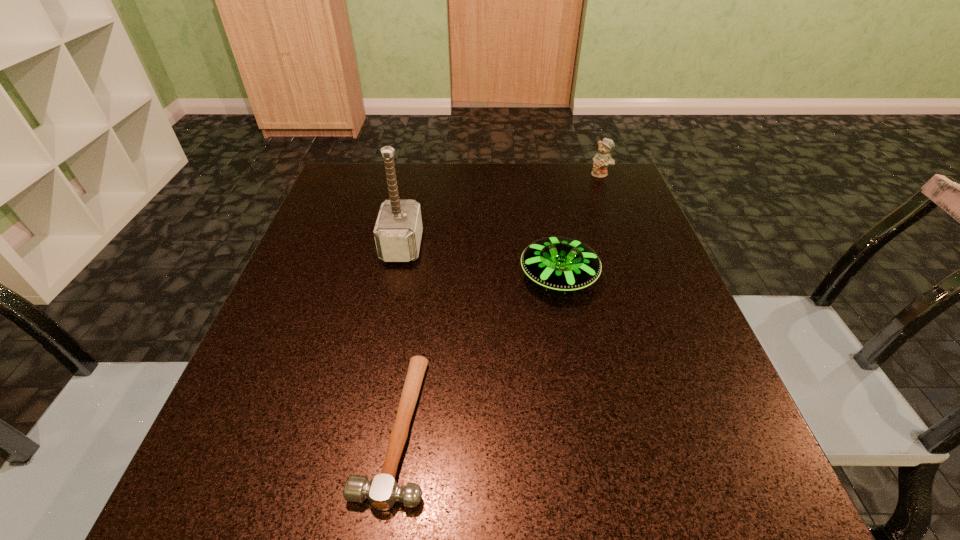
The image size is (960, 540). In order to click on free space at the right edge of the desktop in this screenshot , I will do `click(601, 242)`.

The width and height of the screenshot is (960, 540). In the image, there is a desktop. Find the location of `vacant space at the near left corner`. vacant space at the near left corner is located at coordinates (294, 486).

Locate an element on the screen. The height and width of the screenshot is (540, 960). vacant space at the far right corner of the desktop is located at coordinates (600, 188).

Where is `vacant space at the near right corner of the desktop`? vacant space at the near right corner of the desktop is located at coordinates (714, 507).

Find the location of a particular element. Image resolution: width=960 pixels, height=540 pixels. vacant area that lies between the shorter hammer and the rightmost object is located at coordinates click(498, 301).

Where is `vacant space that is in between the farther hammer and the teddy bear`? The height and width of the screenshot is (540, 960). vacant space that is in between the farther hammer and the teddy bear is located at coordinates (501, 210).

Where is `vacant area between the taller hammer and the third tallest object`? Image resolution: width=960 pixels, height=540 pixels. vacant area between the taller hammer and the third tallest object is located at coordinates (480, 262).

Identify the location of free spot between the tallest object and the nearest object. (399, 337).

Find the location of a particular element. Image resolution: width=960 pixels, height=540 pixels. empty space that is in between the nearer hammer and the farther hammer is located at coordinates (399, 337).

Identify the location of free space between the shortest object and the farther hammer. The height and width of the screenshot is (540, 960). (399, 337).